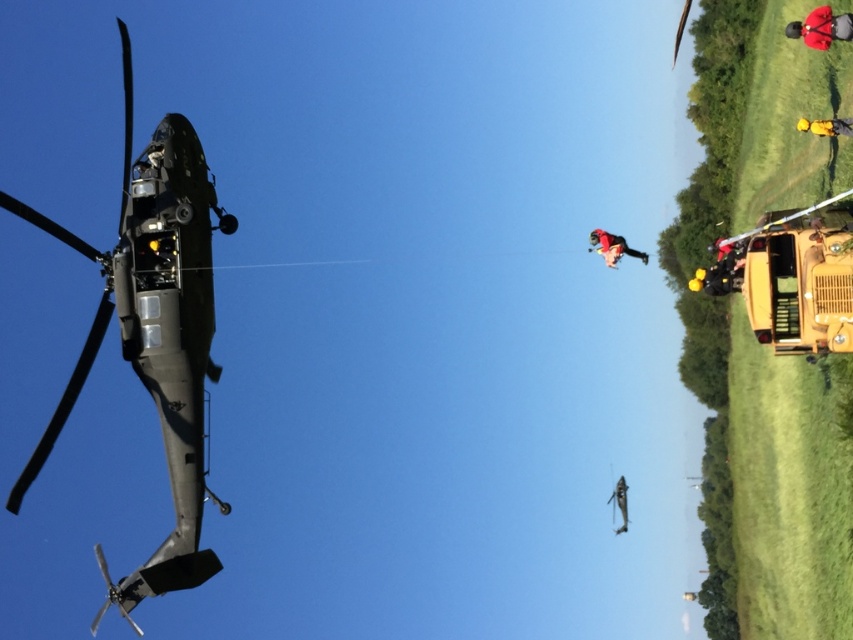
Between matte black helicopter at left and red fabric person at upper right, which one appears on the right side from the viewer's perspective?

Positioned to the right is red fabric person at upper right.

This screenshot has height=640, width=853. What do you see at coordinates (154, 332) in the screenshot?
I see `matte black helicopter at left` at bounding box center [154, 332].

Identify the location of matte black helicopter at left. This screenshot has width=853, height=640. (154, 332).

Is matte black helicopter at left closer to the viewer compared to dark green military uniform at upper center?

Yes, matte black helicopter at left is in front of dark green military uniform at upper center.

Can you confirm if matte black helicopter at left is smaller than dark green military uniform at upper center?

No, matte black helicopter at left is not smaller than dark green military uniform at upper center.

Locate an element on the screen. Image resolution: width=853 pixels, height=640 pixels. matte black helicopter at left is located at coordinates (154, 332).

Which of these two, red fabric person at upper right or yellow hard hat at upper right, stands taller?

Standing taller between the two is red fabric person at upper right.

Locate an element on the screen. red fabric person at upper right is located at coordinates (613, 246).

Image resolution: width=853 pixels, height=640 pixels. I want to click on red fabric person at upper right, so click(613, 246).